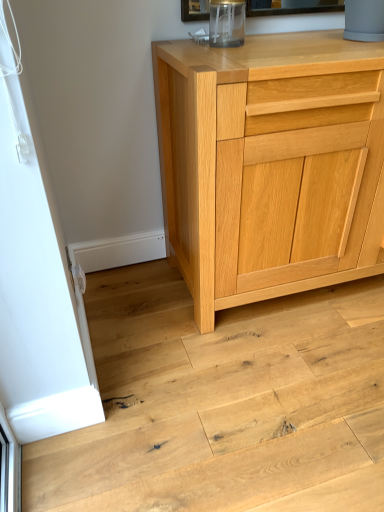
This screenshot has height=512, width=384. I want to click on free point above natural wood floor at lower left (from a real-world perspective), so click(222, 369).